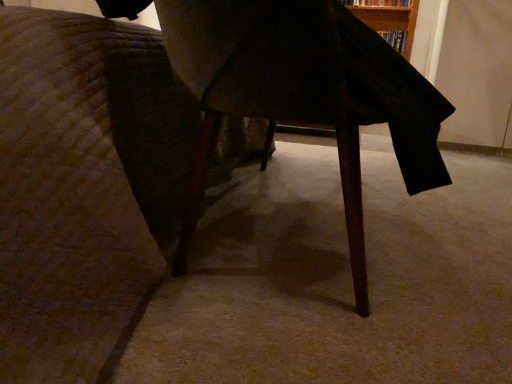
Question: Is the position of wooden table at center less distant than that of wooden table at center?

Choices:
 (A) no
 (B) yes

Answer: (B)

Question: Is wooden table at center aimed at wooden table at center?

Choices:
 (A) yes
 (B) no

Answer: (A)

Question: Can you confirm if wooden table at center is thinner than wooden table at center?

Choices:
 (A) yes
 (B) no

Answer: (B)

Question: From the image's perspective, would you say wooden table at center is shown under wooden table at center?

Choices:
 (A) yes
 (B) no

Answer: (B)

Question: Considering the relative sizes of wooden table at center and wooden table at center in the image provided, is wooden table at center taller than wooden table at center?

Choices:
 (A) yes
 (B) no

Answer: (A)

Question: Is wooden table at center looking in the opposite direction of wooden table at center?

Choices:
 (A) yes
 (B) no

Answer: (B)

Question: Is wooden table at center turned away from hardcover book at upper right?

Choices:
 (A) yes
 (B) no

Answer: (B)

Question: Considering the relative sizes of wooden table at center and hardcover book at upper right in the image provided, is wooden table at center shorter than hardcover book at upper right?

Choices:
 (A) no
 (B) yes

Answer: (A)

Question: From the image's perspective, is wooden table at center located above hardcover book at upper right?

Choices:
 (A) yes
 (B) no

Answer: (B)

Question: Is wooden table at center smaller than hardcover book at upper right?

Choices:
 (A) yes
 (B) no

Answer: (B)

Question: Is wooden table at center touching hardcover book at upper right?

Choices:
 (A) no
 (B) yes

Answer: (A)

Question: Is wooden table at center taller than hardcover book at upper right?

Choices:
 (A) no
 (B) yes

Answer: (B)

Question: Can we say hardcover book at upper right lies outside wooden table at center?

Choices:
 (A) yes
 (B) no

Answer: (A)